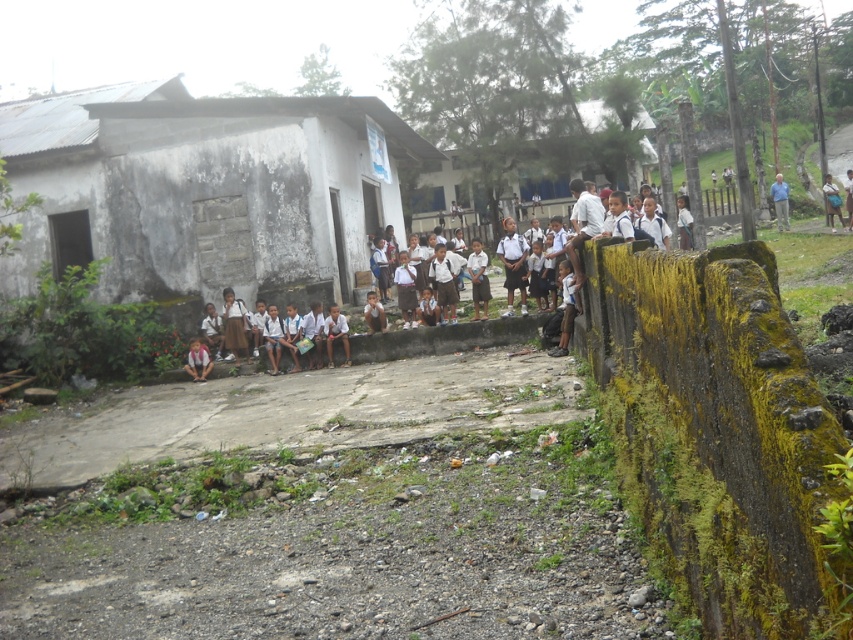
The scene shows a group of children gathered near a weathered building. There is a point marked at coordinates (447, 198). What object in the scene is located at this coordinate?

The point at coordinates (447, 198) corresponds to the white matte hut at upper center.